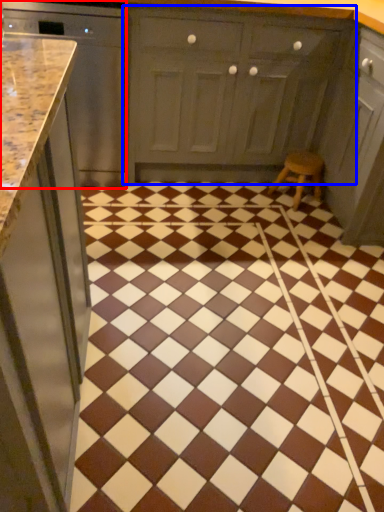
Question: Which object is closer to the camera taking this photo, cabinetry (highlighted by a red box) or cabinetry (highlighted by a blue box)?

Choices:
 (A) cabinetry
 (B) cabinetry

Answer: (A)